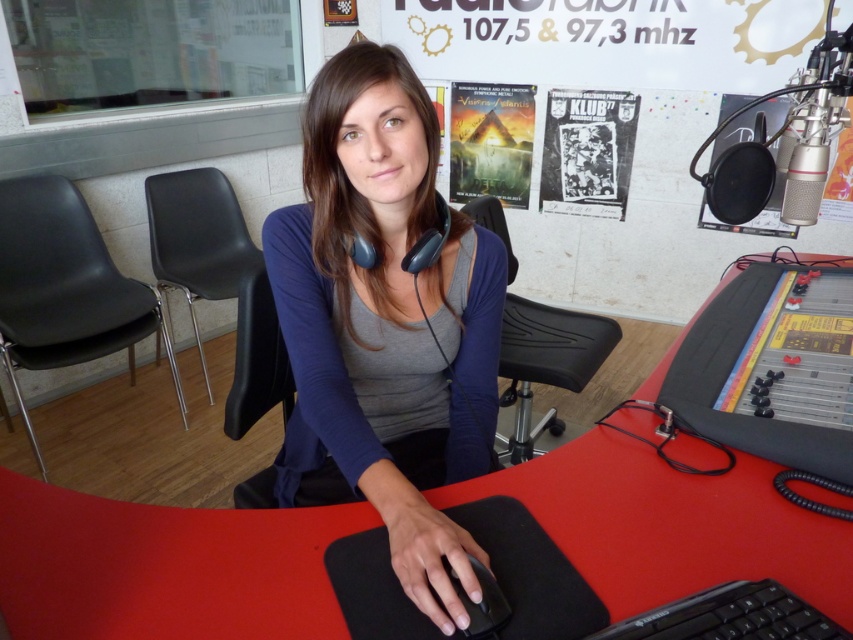
How distant is black plastic swivel chair at left from matte paper poster at upper center?

A distance of 6.60 feet exists between black plastic swivel chair at left and matte paper poster at upper center.

Is black plastic swivel chair at left taller than matte paper poster at upper center?

Correct, black plastic swivel chair at left is much taller as matte paper poster at upper center.

Who is more forward, (9, 237) or (526, 122)?

Point (9, 237) is more forward.

Identify the location of black plastic swivel chair at left. (64, 289).

Who is positioned more to the left, matte black mouse at center or black plastic computer screen at lower right?

matte black mouse at center is more to the left.

Does matte black mouse at center have a smaller size compared to black plastic computer screen at lower right?

Correct, matte black mouse at center occupies less space than black plastic computer screen at lower right.

The width and height of the screenshot is (853, 640). I want to click on matte black mouse at center, so click(x=384, y=323).

Is the position of black paper poster at upper center more distant than that of matte paper poster at upper center?

No, black paper poster at upper center is in front of matte paper poster at upper center.

Can you confirm if black paper poster at upper center is shorter than matte paper poster at upper center?

Yes, black paper poster at upper center is shorter than matte paper poster at upper center.

Is point (608, 157) farther from viewer compared to point (483, 188)?

No, it is in front of (483, 188).

What are the coordinates of `black paper poster at upper center` in the screenshot? It's located at (587, 150).